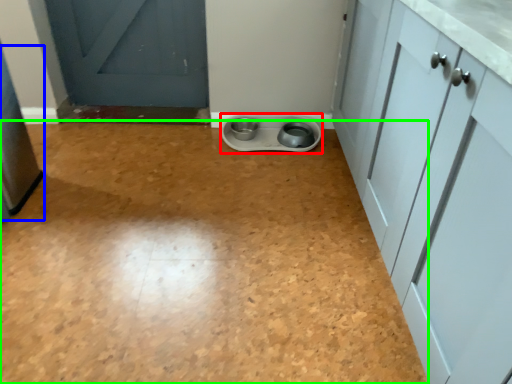
Question: Which object is the farthest from appliance (highlighted by a red box)? Choose among these: appliance (highlighted by a blue box) or plain (highlighted by a green box).

Choices:
 (A) appliance
 (B) plain

Answer: (A)